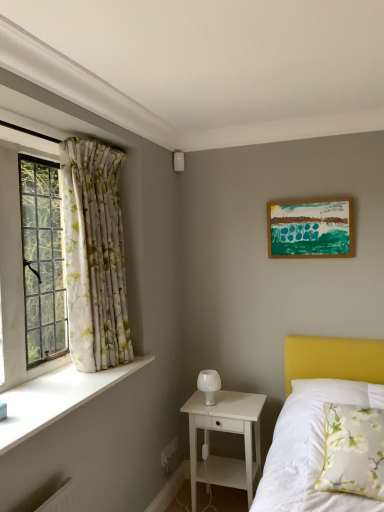
This screenshot has width=384, height=512. I want to click on vacant space underneath floral fabric curtain at left (from a real-world perspective), so click(108, 369).